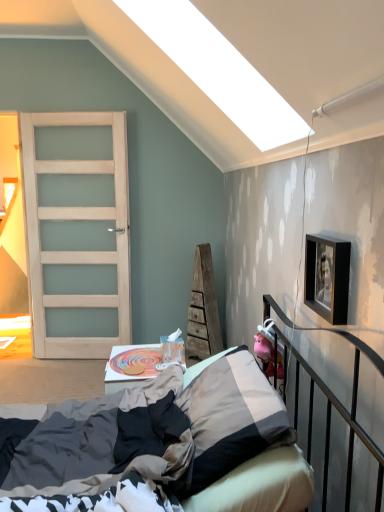
Question: Is textured beige bed at center taller than textured gray pillow at center?

Choices:
 (A) yes
 (B) no

Answer: (A)

Question: From a real-world perspective, does textured beige bed at center sit lower than textured gray pillow at center?

Choices:
 (A) no
 (B) yes

Answer: (B)

Question: Considering the relative sizes of textured beige bed at center and textured gray pillow at center in the image provided, is textured beige bed at center shorter than textured gray pillow at center?

Choices:
 (A) no
 (B) yes

Answer: (A)

Question: Does textured beige bed at center lie in front of textured gray pillow at center?

Choices:
 (A) no
 (B) yes

Answer: (B)

Question: From a real-world perspective, is textured beige bed at center positioned over textured gray pillow at center based on gravity?

Choices:
 (A) yes
 (B) no

Answer: (B)

Question: Looking at their shapes, would you say satin wood door at left is wider or thinner than textured beige bed at center?

Choices:
 (A) thin
 (B) wide

Answer: (A)

Question: From a real-world perspective, relative to textured beige bed at center, is satin wood door at left vertically above or below?

Choices:
 (A) above
 (B) below

Answer: (A)

Question: Is satin wood door at left situated inside textured beige bed at center or outside?

Choices:
 (A) outside
 (B) inside

Answer: (A)

Question: Considering the positions of satin wood door at left and textured beige bed at center in the image, is satin wood door at left bigger or smaller than textured beige bed at center?

Choices:
 (A) small
 (B) big

Answer: (A)

Question: Is point (256, 348) closer or farther from the camera than point (46, 418)?

Choices:
 (A) farther
 (B) closer

Answer: (A)

Question: Looking at their shapes, would you say pink rubber piggy bank at right is wider or thinner than textured beige bed at center?

Choices:
 (A) thin
 (B) wide

Answer: (A)

Question: Considering the relative positions of pink rubber piggy bank at right and textured beige bed at center in the image provided, is pink rubber piggy bank at right to the left or to the right of textured beige bed at center?

Choices:
 (A) right
 (B) left

Answer: (A)

Question: From the image's perspective, is pink rubber piggy bank at right located above or below textured beige bed at center?

Choices:
 (A) below
 (B) above

Answer: (B)

Question: In the image, is satin wood door at left on the left side or the right side of pink rubber piggy bank at right?

Choices:
 (A) right
 (B) left

Answer: (B)

Question: From a real-world perspective, is satin wood door at left physically located above or below pink rubber piggy bank at right?

Choices:
 (A) above
 (B) below

Answer: (A)